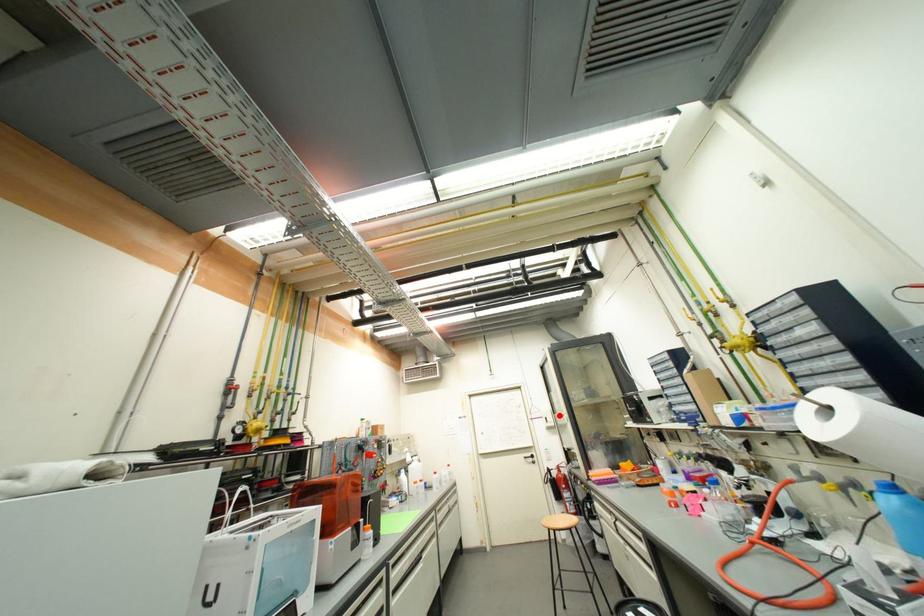
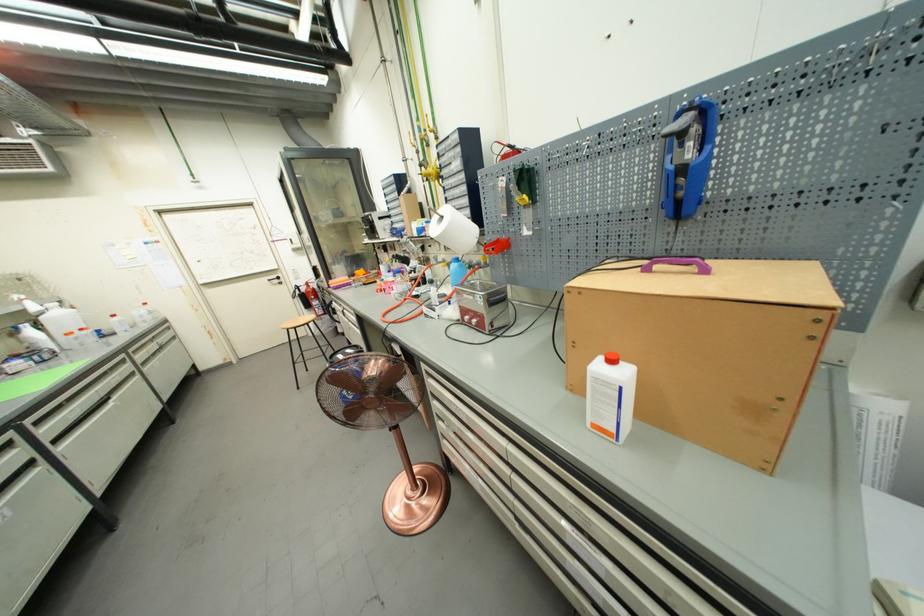
Find the pixel in the second image that matches the highlighted location in the first image.

(306, 237)